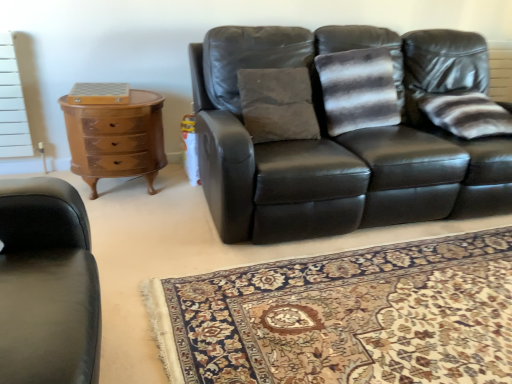
Identify the location of free spot to the right of wooden glossy chest of drawers at left. This screenshot has width=512, height=384. (178, 201).